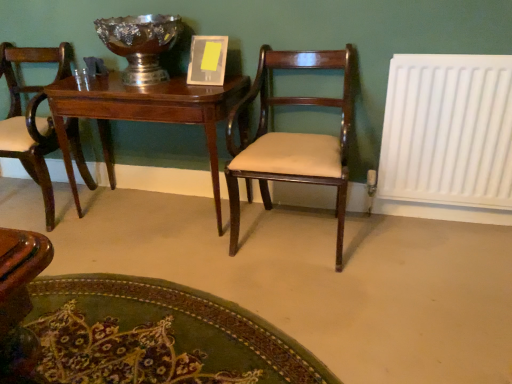
The height and width of the screenshot is (384, 512). Find the location of `free point below white plastic radiator at right (from a real-world perspective)`. free point below white plastic radiator at right (from a real-world perspective) is located at coordinates (436, 223).